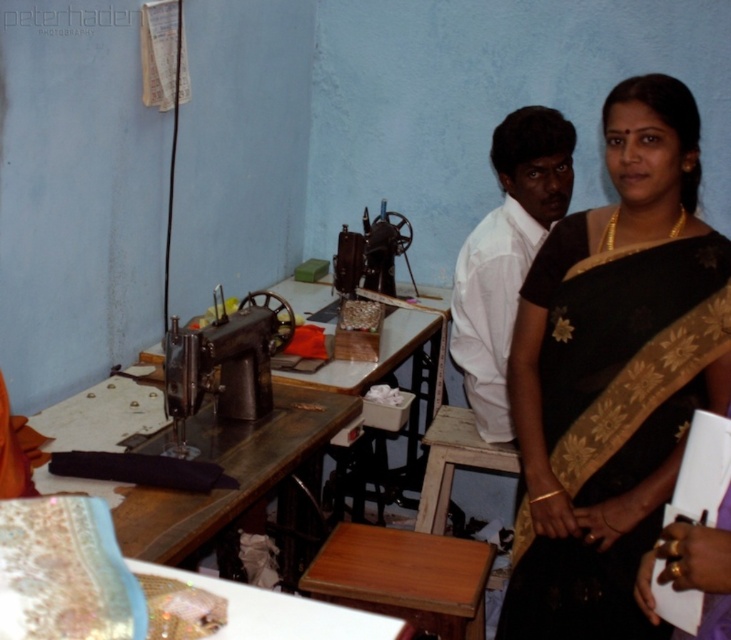
You are standing at the entrance of the sewing workshop and see the point marked at coordinates (613,372). Which object in the scene does this point belong to?

The point at coordinates (613,372) is located on the black silk saree at right.

You are a tailor who needs to move a fabric roll from the wooden table at center to the metallic sewing machine at center. Which direction should you move the fabric roll to place it on the sewing machine?

The wooden table at center is positioned on the left side of the metallic sewing machine at center, so you should move the fabric roll to the right to place it on the sewing machine.

You are organizing a fashion show and need to display the black silk saree at right. Since the wooden table at center is in the way, can you place the saree on the table without it hanging off the edges?

The black silk saree at right has a larger size compared to wooden table at center, so placing it on the table would cause the saree to hang off the edges since it is bigger than the table.